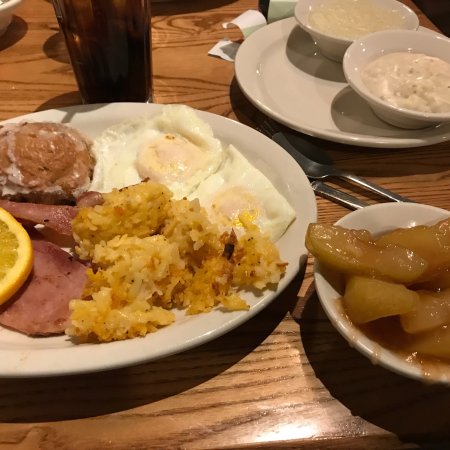
This screenshot has width=450, height=450. In order to click on cup in this screenshot , I will do `click(121, 54)`.